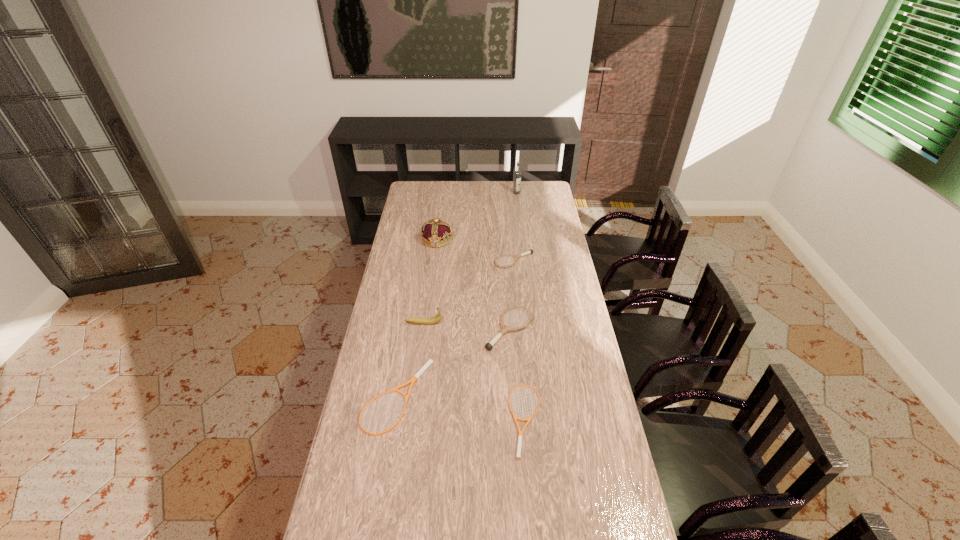
This screenshot has height=540, width=960. In order to click on empty space between the third tallest object and the second tallest object in this screenshot , I will do pyautogui.click(x=430, y=281).

The width and height of the screenshot is (960, 540). I want to click on unoccupied position between the farther gray tennis racket and the vodka, so click(x=516, y=227).

This screenshot has width=960, height=540. I want to click on free space between the smaller beige tennis racket and the sixth nearest object, so click(x=482, y=330).

Image resolution: width=960 pixels, height=540 pixels. In order to click on unoccupied area between the fifth shortest object and the vodka in this screenshot , I will do `click(470, 258)`.

This screenshot has width=960, height=540. Find the location of `vacant point located between the bigger gray tennis racket and the farther gray tennis racket`. vacant point located between the bigger gray tennis racket and the farther gray tennis racket is located at coordinates (512, 295).

Image resolution: width=960 pixels, height=540 pixels. In order to click on free spot between the purple crown and the fifth tallest object in this screenshot , I will do `click(475, 250)`.

Find the location of a particular element. empty location between the second farthest tennis racket and the sixth tallest object is located at coordinates (451, 363).

Identify the location of object that ranks as the fifth closest to the nearer gray tennis racket. (436, 233).

You are a GUI agent. You are given a task and a screenshot of the screen. Output one action in this format:
    pyautogui.click(x=<x>, y=<y>)
    Task: Click on the object that is the fourth nearest to the second shortest tennis racket
    The image size is (960, 540).
    Given the screenshot: What is the action you would take?
    pyautogui.click(x=530, y=251)

This screenshot has height=540, width=960. In order to click on the closest tennis racket to the banana in this screenshot , I will do `click(505, 328)`.